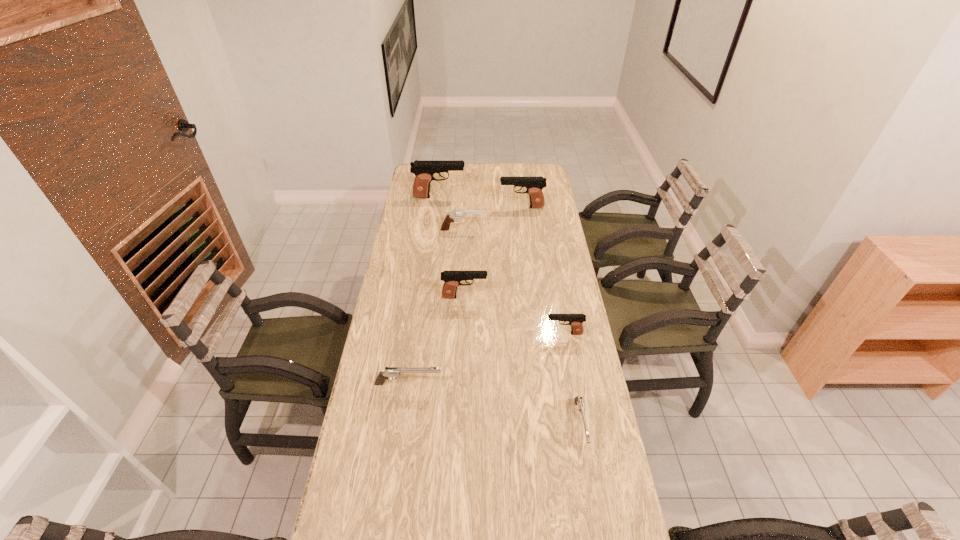
Identify the location of the sixth tallest object. (389, 372).

I want to click on the smaller silver pistol, so click(x=579, y=402).

Where is `the nearest pistol`? This screenshot has width=960, height=540. the nearest pistol is located at coordinates (579, 402).

The image size is (960, 540). What are the coordinates of `free space located 0.110m at the barrel of the farthest object` in the screenshot? It's located at (487, 197).

At what (x,y) coordinates should I click in order to perform the action: click on vacant region located 0.380m at the barrel of the second farthest black pistol. Please return your answer as a coordinate pair (x, y). The width and height of the screenshot is (960, 540). Looking at the image, I should click on (423, 207).

Identify the location of vacant space located at the barrel of the second farthest black pistol. The width and height of the screenshot is (960, 540). pos(445,207).

Locate an element on the screen. vacant area situated 0.300m at the barrel of the second farthest black pistol is located at coordinates (440, 207).

Locate an element on the screen. This screenshot has height=540, width=960. vacant space positioned at the barrel of the third farthest pistol is located at coordinates (567, 297).

I want to click on free space located 0.240m at the muzzle of the third farthest object, so click(535, 230).

Identify the location of free spot located 0.390m at the barrel of the smallest black pistol. This screenshot has height=540, width=960. (440, 334).